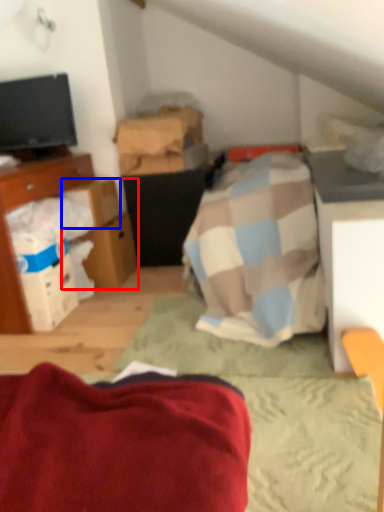
Question: Which point is further to the camera, cardboard box (highlighted by a red box) or cardboard box (highlighted by a blue box)?

Choices:
 (A) cardboard box
 (B) cardboard box

Answer: (A)